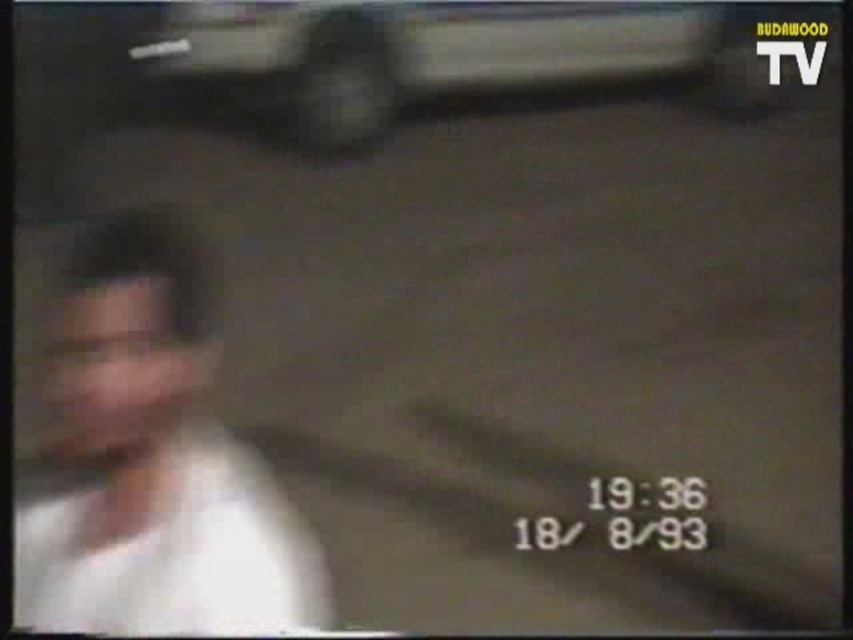
Question: Which point appears closest to the camera in this image?

Choices:
 (A) (242, 513)
 (B) (619, 42)

Answer: (B)

Question: Does white matte shirt at left appear on the left side of metallic silver car at upper center?

Choices:
 (A) no
 (B) yes

Answer: (B)

Question: Can you confirm if white matte shirt at left is thinner than metallic silver car at upper center?

Choices:
 (A) yes
 (B) no

Answer: (A)

Question: Which point is farther from the camera taking this photo?

Choices:
 (A) (204, 324)
 (B) (177, 35)

Answer: (A)

Question: Is the position of white matte shirt at left less distant than that of metallic silver car at upper center?

Choices:
 (A) yes
 (B) no

Answer: (A)